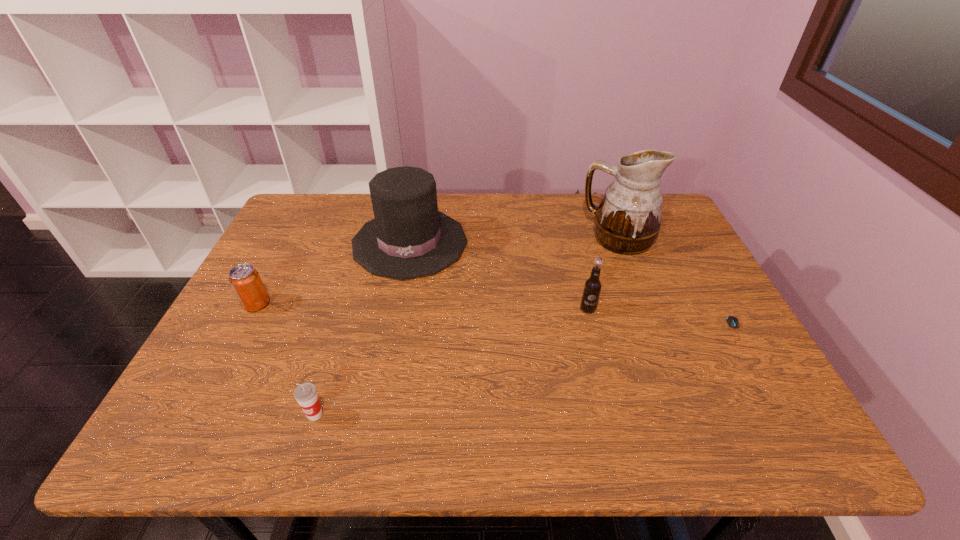
The image size is (960, 540). Find the location of `free location located from the spout of the tallest object`. free location located from the spout of the tallest object is located at coordinates (556, 238).

This screenshot has width=960, height=540. Identify the location of free space located from the spout of the tallest object. (537, 238).

Image resolution: width=960 pixels, height=540 pixels. In order to click on vacant space located on the front of the fifth shortest object with the decoration in this screenshot , I will do `click(393, 332)`.

In order to click on vacant space located 0.320m on the label of the root beer in this screenshot , I will do `click(619, 434)`.

Locate an element on the screen. This screenshot has height=540, width=960. free space located on the front of the soda can is located at coordinates (199, 413).

Locate an element on the screen. The image size is (960, 540). free space located on the left of the rightmost object is located at coordinates (690, 330).

Where is `pitcher that is at the far edge`? pitcher that is at the far edge is located at coordinates (628, 218).

Where is `dress hat located in the far edge section of the desktop`? dress hat located in the far edge section of the desktop is located at coordinates (408, 238).

The height and width of the screenshot is (540, 960). Find the location of `object located in the near edge section of the desktop`. object located in the near edge section of the desktop is located at coordinates (306, 395).

Where is `object positioned at the left edge`? The image size is (960, 540). object positioned at the left edge is located at coordinates (244, 279).